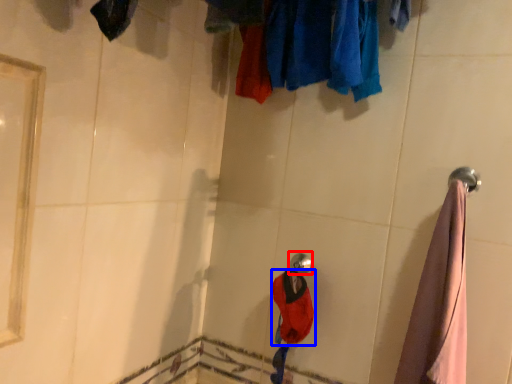
Question: Which object appears closest to the camera in this image, shower (highlighted by a red box) or clothing (highlighted by a blue box)?

Choices:
 (A) shower
 (B) clothing

Answer: (B)